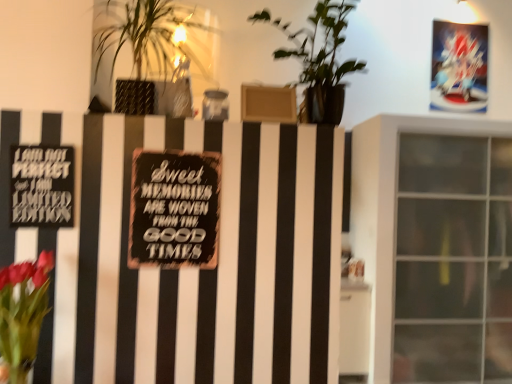
Find the location of a particular element. transparent glass window at right is located at coordinates (435, 246).

What is the approximate height of black matte sign at left, marked as the 1th plaque in a left-to-right arrangement?

black matte sign at left, marked as the 1th plaque in a left-to-right arrangement, is 11.53 inches in height.

Describe the element at coordinates (150, 52) in the screenshot. I see `green leafy plant at upper left, which appears as the second houseplant when viewed from the right` at that location.

Locate an element on the screen. The height and width of the screenshot is (384, 512). transparent glass window at right is located at coordinates (435, 246).

From a real-world perspective, is black matte sign at left, marked as the 2th plaque in a right-to-left arrangement, physically above green leafy plant at upper left, acting as the first houseplant starting from the left?

Actually, black matte sign at left, marked as the 2th plaque in a right-to-left arrangement, is physically below green leafy plant at upper left, acting as the first houseplant starting from the left, in the real world.

Between black matte sign at left, marked as the 1th plaque in a left-to-right arrangement, and green leafy plant at upper left, acting as the first houseplant starting from the left, which one has smaller width?

With smaller width is black matte sign at left, marked as the 1th plaque in a left-to-right arrangement.

Who is taller, black matte sign at left, arranged as the first plaque when viewed from the front, or green leafy plant at upper left, acting as the first houseplant starting from the left?

green leafy plant at upper left, acting as the first houseplant starting from the left.

In the scene shown: Which object is closer to the camera taking this photo, black matte sign at left, arranged as the first plaque when viewed from the front, or green leafy plant at upper left, which appears as the second houseplant when viewed from the right?

green leafy plant at upper left, which appears as the second houseplant when viewed from the right, is in front.

Is point (279, 28) farther from camera compared to point (17, 175)?

Yes.

Who is taller, green leafy plant at center, which is counted as the first houseplant, starting from the right, or black matte sign at left, arranged as the first plaque when viewed from the front?

green leafy plant at center, which is counted as the first houseplant, starting from the right, is taller.

Which of these two, green leafy plant at center, which is counted as the first houseplant, starting from the right, or black matte sign at left, marked as the 2th plaque in a right-to-left arrangement, is thinner?

With smaller width is black matte sign at left, marked as the 2th plaque in a right-to-left arrangement.

From the black matte sign at left, arranged as the first plaque when viewed from the front, count 2nd houseplants forward and point to it. Please provide its 2D coordinates.

[(319, 60)]

Do you think green leafy plant at upper left, acting as the first houseplant starting from the left, is within green leafy plant at center, which is counted as the first houseplant, starting from the right, or outside of it?

green leafy plant at upper left, acting as the first houseplant starting from the left, is located beyond the bounds of green leafy plant at center, which is counted as the first houseplant, starting from the right.

Considering the sizes of objects green leafy plant at upper left, which appears as the second houseplant when viewed from the right, and green leafy plant at center, which is counted as the second houseplant, starting from the left, in the image provided, who is bigger, green leafy plant at upper left, which appears as the second houseplant when viewed from the right, or green leafy plant at center, which is counted as the second houseplant, starting from the left,?

green leafy plant at center, which is counted as the second houseplant, starting from the left, is bigger.

From the image's perspective, is green leafy plant at upper left, which appears as the second houseplant when viewed from the right, above or below green leafy plant at center, which is counted as the first houseplant, starting from the right?

green leafy plant at upper left, which appears as the second houseplant when viewed from the right, is above green leafy plant at center, which is counted as the first houseplant, starting from the right.

Considering the sizes of objects green leafy plant at upper left, acting as the first houseplant starting from the left, and green leafy plant at center, which is counted as the second houseplant, starting from the left, in the image provided, who is taller, green leafy plant at upper left, acting as the first houseplant starting from the left, or green leafy plant at center, which is counted as the second houseplant, starting from the left,?

green leafy plant at center, which is counted as the second houseplant, starting from the left, is taller.

The height and width of the screenshot is (384, 512). What are the coordinates of `plaque on the left of vivid pink petals at lower left` in the screenshot? It's located at (42, 186).

Who is shorter, black matte sign at left, marked as the 2th plaque in a right-to-left arrangement, or vivid pink petals at lower left?

black matte sign at left, marked as the 2th plaque in a right-to-left arrangement.

From the image's perspective, which one is positioned higher, black matte sign at left, marked as the 2th plaque in a right-to-left arrangement, or vivid pink petals at lower left?

From the image's view, black matte sign at left, marked as the 2th plaque in a right-to-left arrangement, is above.

Considering the relative sizes of black matte sign at left, marked as the 2th plaque in a right-to-left arrangement, and vivid pink petals at lower left in the image provided, is black matte sign at left, marked as the 2th plaque in a right-to-left arrangement, bigger than vivid pink petals at lower left?

Incorrect, black matte sign at left, marked as the 2th plaque in a right-to-left arrangement, is not larger than vivid pink petals at lower left.

Is black matte sign at center, which appears as the 1th plaque when viewed from the back, aimed at green leafy plant at center, which is counted as the first houseplant, starting from the right?

No.

In the scene shown: Is black matte sign at center, which appears as the 2th plaque when viewed from the left, bigger than green leafy plant at center, which is counted as the second houseplant, starting from the left?

No, black matte sign at center, which appears as the 2th plaque when viewed from the left, is not bigger than green leafy plant at center, which is counted as the second houseplant, starting from the left.

Measure the distance from black matte sign at center, marked as the first plaque in a right-to-left arrangement, to green leafy plant at center, which is counted as the second houseplant, starting from the left.

68.42 centimeters.

Is green leafy plant at center, which is counted as the second houseplant, starting from the left, taller than transparent glass window at right?

Incorrect, the height of green leafy plant at center, which is counted as the second houseplant, starting from the left, is not larger of that of transparent glass window at right.

Considering the relative positions of green leafy plant at center, which is counted as the second houseplant, starting from the left, and transparent glass window at right in the image provided, is green leafy plant at center, which is counted as the second houseplant, starting from the left, to the left or to the right of transparent glass window at right?

green leafy plant at center, which is counted as the second houseplant, starting from the left, is positioned on transparent glass window at right's left side.

Relative to transparent glass window at right, is green leafy plant at center, which is counted as the first houseplant, starting from the right, in front or behind?

Visually, green leafy plant at center, which is counted as the first houseplant, starting from the right, is located in front of transparent glass window at right.

Considering the relative sizes of green leafy plant at center, which is counted as the first houseplant, starting from the right, and transparent glass window at right in the image provided, is green leafy plant at center, which is counted as the first houseplant, starting from the right, wider than transparent glass window at right?

No.

How many degrees apart are the facing directions of transparent glass window at right and green leafy plant at upper left, acting as the first houseplant starting from the left?

The angle between the facing direction of transparent glass window at right and the facing direction of green leafy plant at upper left, acting as the first houseplant starting from the left, is 3.03 degrees.

Does transparent glass window at right have a larger size compared to green leafy plant at upper left, which appears as the second houseplant when viewed from the right?

Yes.

In the scene shown: Which point is more distant from viewer, [434,371] or [128,3]?

Positioned behind is point [434,371].

In the scene shown: Between transparent glass window at right and green leafy plant at upper left, acting as the first houseplant starting from the left, which one has larger width?

With larger width is transparent glass window at right.

Where is `the 1st houseplant to the right when counting from the black matte sign at left, marked as the 2th plaque in a right-to-left arrangement`? The image size is (512, 384). the 1st houseplant to the right when counting from the black matte sign at left, marked as the 2th plaque in a right-to-left arrangement is located at coordinates (150, 52).

From the black matte sign at left, marked as the 2th plaque in a right-to-left arrangement, count 2nd houseplants forward and point to it. Please provide its 2D coordinates.

[(319, 60)]

Looking at the image, which one is located closer to black matte sign at center, marked as the first plaque in a right-to-left arrangement, black matte sign at left, the second plaque in the back-to-front sequence, or vivid pink petals at lower left?

Based on the image, black matte sign at left, the second plaque in the back-to-front sequence, appears to be nearer to black matte sign at center, marked as the first plaque in a right-to-left arrangement.

Looking at this image, looking at the image, which one is located further to green leafy plant at center, which is counted as the second houseplant, starting from the left, black matte sign at center, which appears as the 2th plaque when viewed from the left, or vivid pink petals at lower left?

The object further to green leafy plant at center, which is counted as the second houseplant, starting from the left, is vivid pink petals at lower left.

Based on the photo, considering their positions, is black matte sign at left, marked as the 2th plaque in a right-to-left arrangement, positioned closer to vivid pink petals at lower left than green leafy plant at center, which is counted as the second houseplant, starting from the left?

black matte sign at left, marked as the 2th plaque in a right-to-left arrangement.

Considering their positions, is black matte sign at left, marked as the 1th plaque in a left-to-right arrangement, positioned closer to black matte sign at center, which appears as the 1th plaque when viewed from the back, than green leafy plant at upper left, acting as the first houseplant starting from the left?

black matte sign at left, marked as the 1th plaque in a left-to-right arrangement, is closer to black matte sign at center, which appears as the 1th plaque when viewed from the back.

Looking at the image, which one is located further to transparent glass window at right, vivid pink petals at lower left or black matte sign at center, which appears as the 1th plaque when viewed from the back?

Among the two, vivid pink petals at lower left is located further to transparent glass window at right.

From the image, which object appears to be farther from vivid pink petals at lower left, black matte sign at center, marked as the first plaque in a right-to-left arrangement, or black matte sign at left, the second plaque in the back-to-front sequence?

Among the two, black matte sign at center, marked as the first plaque in a right-to-left arrangement, is located further to vivid pink petals at lower left.

Estimate the real-world distances between objects in this image. Which object is closer to black matte sign at left, marked as the 2th plaque in a right-to-left arrangement, green leafy plant at upper left, acting as the first houseplant starting from the left, or vivid pink petals at lower left?

vivid pink petals at lower left is positioned closer to the anchor black matte sign at left, marked as the 2th plaque in a right-to-left arrangement.

Considering their positions, is transparent glass window at right positioned closer to vivid pink petals at lower left than green leafy plant at center, which is counted as the first houseplant, starting from the right?

Among the two, green leafy plant at center, which is counted as the first houseplant, starting from the right, is located nearer to vivid pink petals at lower left.

Identify the location of plaque between green leafy plant at upper left, which appears as the second houseplant when viewed from the right, and transparent glass window at right from left to right. (174, 209).

Identify the location of floral arrangement between black matte sign at left, marked as the 1th plaque in a left-to-right arrangement, and black matte sign at center, which appears as the 1th plaque when viewed from the back, in the horizontal direction. The width and height of the screenshot is (512, 384). pyautogui.click(x=23, y=313).

You are a GUI agent. You are given a task and a screenshot of the screen. Output one action in this format:
    pyautogui.click(x=<x>, y=<y>)
    Task: Click on the plaque situated between black matte sign at left, arranged as the first plaque when viewed from the front, and transparent glass window at right from left to right
    This screenshot has width=512, height=384.
    Given the screenshot: What is the action you would take?
    pyautogui.click(x=174, y=209)

At what (x,y) coordinates should I click in order to perform the action: click on plaque between black matte sign at left, marked as the 2th plaque in a right-to-left arrangement, and green leafy plant at center, which is counted as the second houseplant, starting from the left. Please return your answer as a coordinate pair (x, y). Looking at the image, I should click on (174, 209).